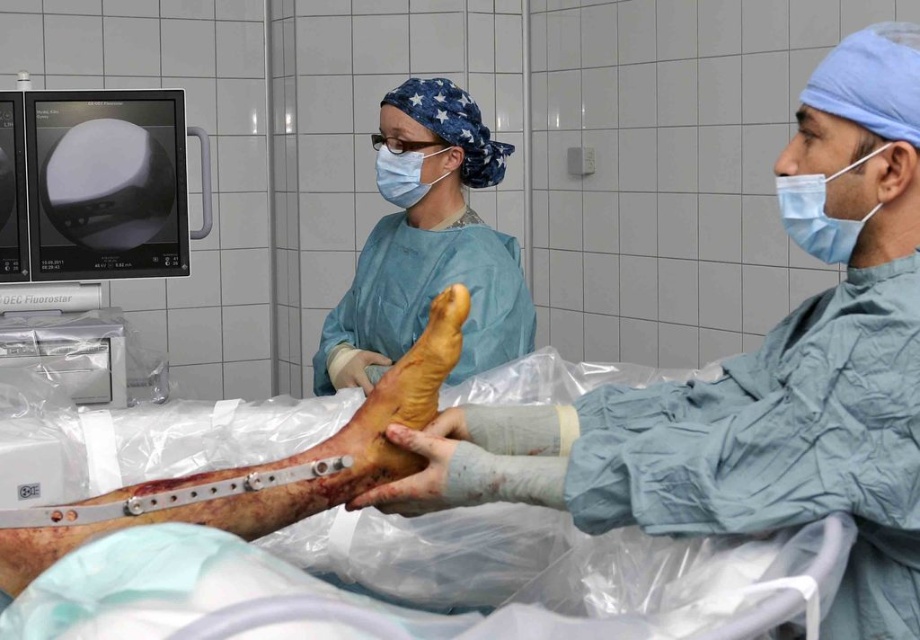
Question: Does metallic/plastic bone at center lie in front of blue matte mask at upper center?

Choices:
 (A) no
 (B) yes

Answer: (B)

Question: Which point is farther to the camera?

Choices:
 (A) blue matte mask at upper center
 (B) blue surgical mask at right

Answer: (A)

Question: Which point is closer to the camera?

Choices:
 (A) blue surgical gown at center
 (B) blue surgical mask at right
 (C) blue matte mask at upper center

Answer: (B)

Question: Does blue surgical gown at center appear over blue surgical mask at right?

Choices:
 (A) no
 (B) yes

Answer: (B)

Question: Based on their relative distances, which object is farther from the blue surgical mask at right?

Choices:
 (A) metallic/plastic bone at center
 (B) blue surgical gown at center

Answer: (B)

Question: Does blue surgical gown at center appear under metallic/plastic bone at center?

Choices:
 (A) no
 (B) yes

Answer: (A)